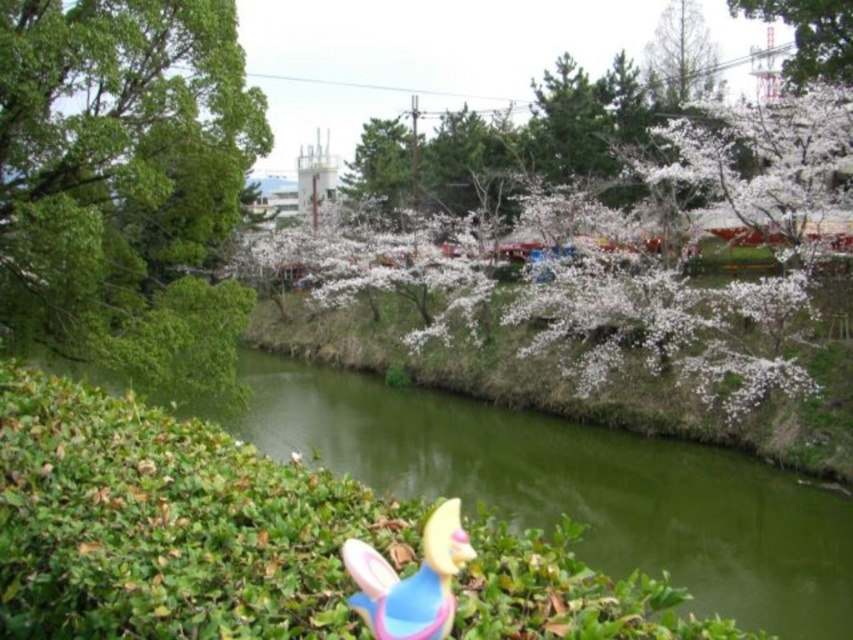
Can you confirm if pastel plastic bunny at lower center is thinner than smooth brown tree trunk at upper right?

Indeed, pastel plastic bunny at lower center has a lesser width compared to smooth brown tree trunk at upper right.

Between point (442, 545) and point (695, 19), which one is positioned behind?

Point (695, 19)

Is point (418, 620) less distant than point (680, 90)?

Yes, it is in front of point (680, 90).

The height and width of the screenshot is (640, 853). In order to click on pastel plastic bunny at lower center in this screenshot , I will do `click(410, 580)`.

Who is lower down, green leafy tree at upper right or smooth brown tree trunk at upper right?

Positioned lower is green leafy tree at upper right.

Is point (849, 45) farther from camera compared to point (701, 65)?

No, (849, 45) is closer to viewer.

Where is `green leafy tree at upper right`? This screenshot has height=640, width=853. green leafy tree at upper right is located at coordinates (808, 36).

The width and height of the screenshot is (853, 640). In order to click on green leafy tree at upper right in this screenshot , I will do `click(808, 36)`.

Can you confirm if green smooth water at center is smaller than pastel plastic bunny at lower center?

Actually, green smooth water at center might be larger than pastel plastic bunny at lower center.

Does green smooth water at center appear over pastel plastic bunny at lower center?

Actually, green smooth water at center is below pastel plastic bunny at lower center.

You are a GUI agent. You are given a task and a screenshot of the screen. Output one action in this format:
    pyautogui.click(x=<x>, y=<y>)
    Task: Click on the green smooth water at center
    Image resolution: width=853 pixels, height=640 pixels.
    Given the screenshot: What is the action you would take?
    pyautogui.click(x=393, y=515)